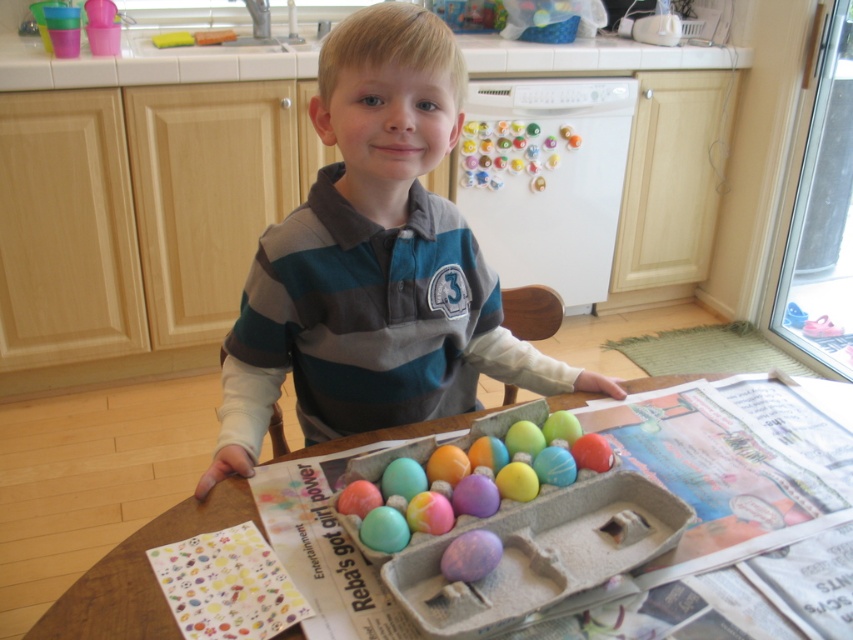
The user is a parent trying to clean up after an Easter egg activity. They need to know where to place the pastel matte eggs at center and the cardboard tray at center to organize them properly. According to the scene, which item should be placed on top of the other?

The pastel matte eggs at center should be placed on top of the cardboard tray at center since the pastel matte eggs at center is above the cardboard tray at center in the image.

You are a parent trying to ensure your child can reach both the striped cotton shirt at center and the pastel matte eggs at center during snack time. Can the child comfortably reach both items if their arms can extend 12 inches?

The striped cotton shirt at center and the pastel matte eggs at center are 11.03 inches apart, so yes, the child can comfortably reach both items since the distance between them is within the 12 inches arm extension range.

Looking at this image, what is the 2D coordinate of the striped cotton shirt at center?

The striped cotton shirt at center is located at the 2D coordinate point of (374, 262).